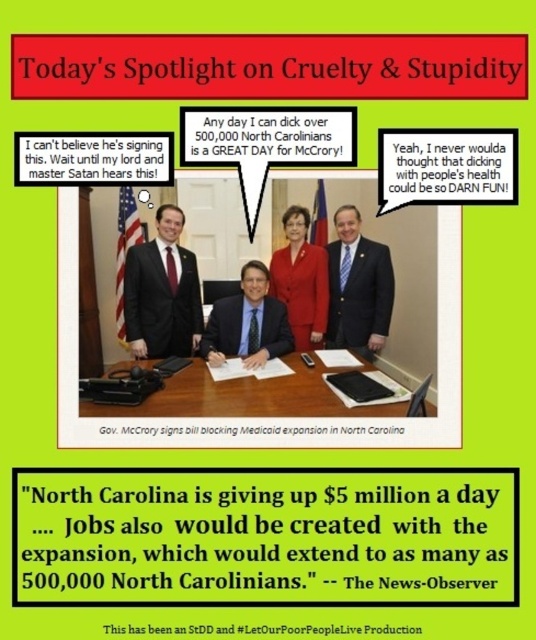
Between white paper at center and blue suit at center, which one has less height?

Standing shorter between the two is white paper at center.

Is white paper at center bigger than blue suit at center?

Yes, white paper at center is bigger than blue suit at center.

This screenshot has height=640, width=536. I want to click on white paper at center, so click(x=244, y=396).

Between point (152, 348) and point (361, 317), which one is positioned behind?

The point (361, 317) is behind.

Where is `matte black suit at center`? matte black suit at center is located at coordinates (161, 292).

Can you confirm if matte black suit at center is positioned above matte red suit at center?

No.

Does point (195, 305) lie in front of point (286, 266)?

That is False.

Identify the location of matte black suit at center. The height and width of the screenshot is (640, 536). (161, 292).